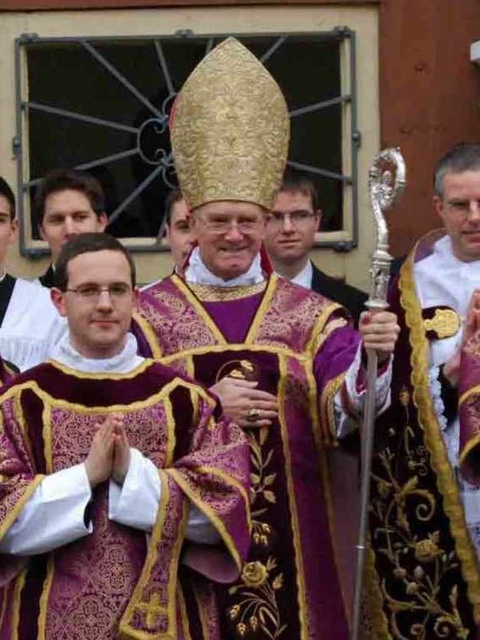
You are standing in the crowd watching the religious ceremony. There are two points marked in the image. The first point is at coordinate point (156, 468) and the second is at point (436, 436). Which point is closer to you?

Point (156, 468) is in front of point (436, 436), so the first point is closer to you.